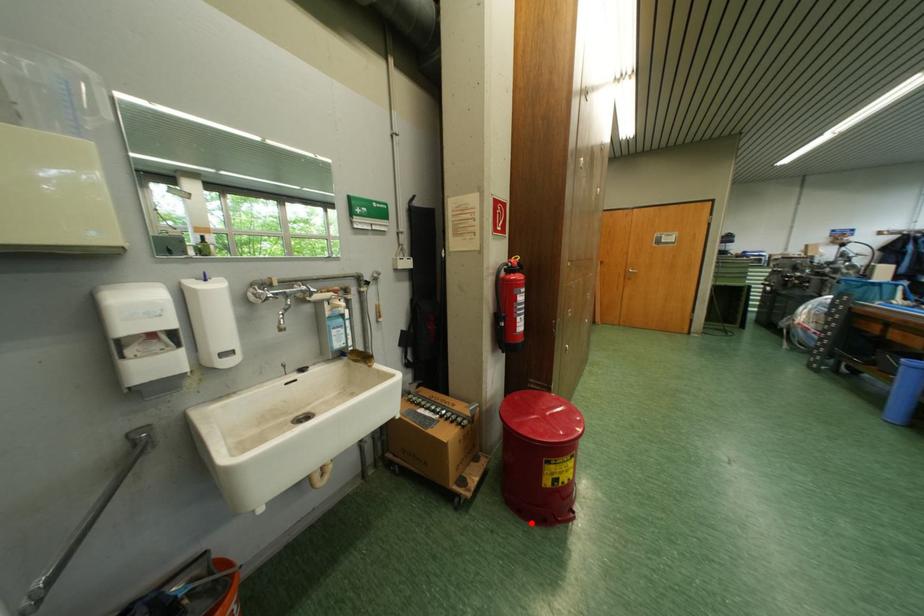
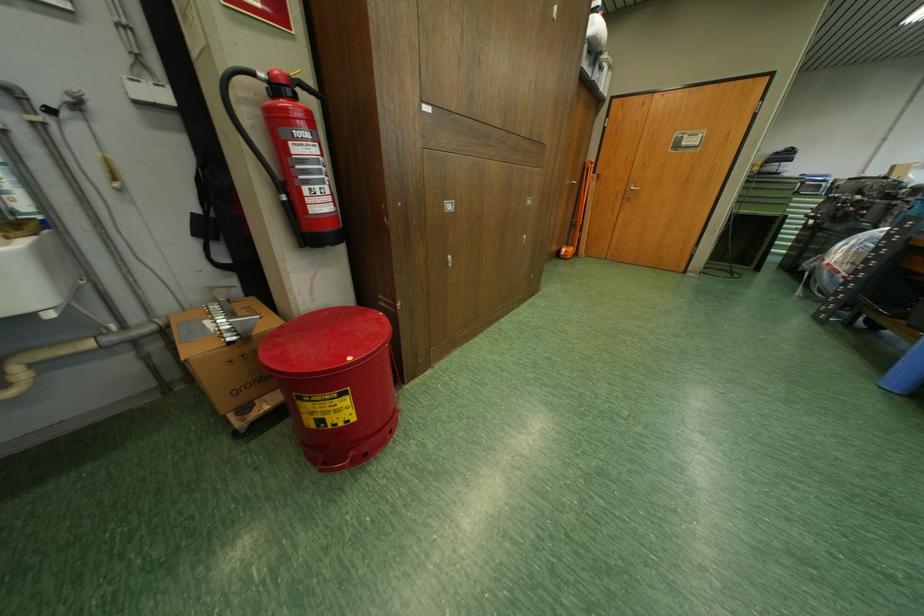
Question: I am providing you with two images of the same scene from different viewpoints. A red point is shown in image1. For the corresponding object point in image2, is it positioned nearer or farther from the camera?

Choices:
 (A) Nearer
 (B) Farther

Answer: (B)